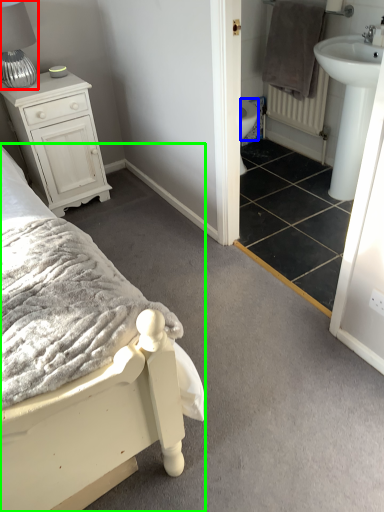
Question: Which object is the closest to the table lamp (highlighted by a red box)? Choose among these: bidet (highlighted by a blue box) or bed (highlighted by a green box).

Choices:
 (A) bidet
 (B) bed

Answer: (B)